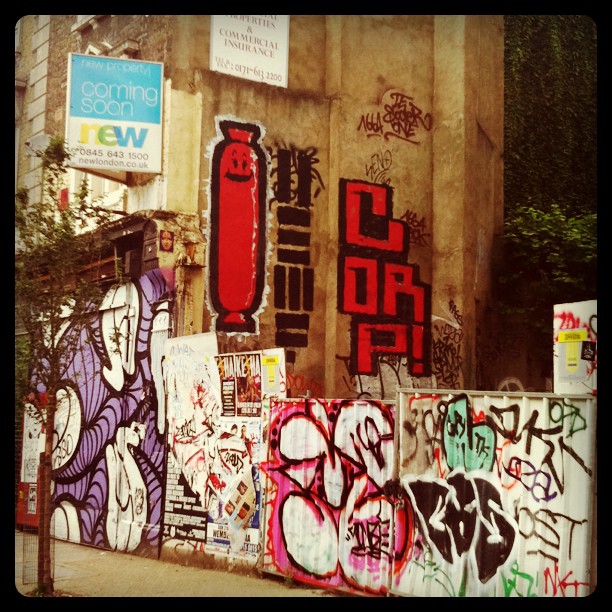
Where is `wall`? The width and height of the screenshot is (612, 612). wall is located at coordinates (419, 182).